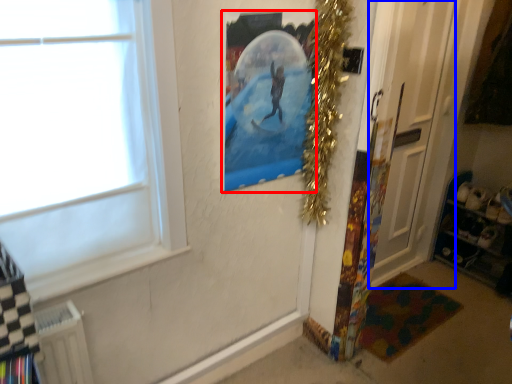
Question: Which object appears closest to the camera in this image, picture frame (highlighted by a red box) or door (highlighted by a blue box)?

Choices:
 (A) picture frame
 (B) door

Answer: (A)